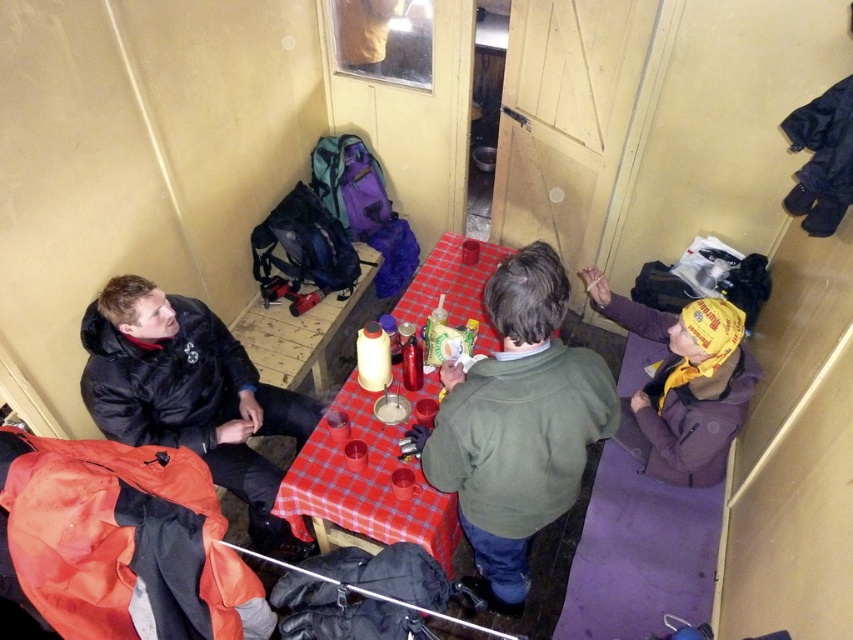
You are trying to decide whether to place a large backpack between the black matte jacket at left and the yellow fabric headband at right. Based on their widths, can you determine if there is enough space?

The black matte jacket at left might be wider than yellow fabric headband at right, so there might not be enough space for the backpack between them.